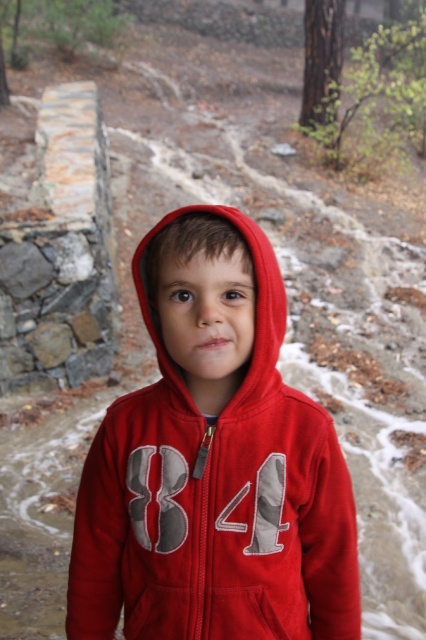
Measure the distance between matte fleece hoodie at center and camera.

The distance of matte fleece hoodie at center from camera is 98.86 centimeters.

What do you see at coordinates (213, 464) in the screenshot?
I see `matte fleece hoodie at center` at bounding box center [213, 464].

Between point (249, 384) and point (267, 282), which one is positioned in front?

Point (267, 282)

Image resolution: width=426 pixels, height=640 pixels. What are the coordinates of `matte fleece hoodie at center` in the screenshot? It's located at point(213,464).